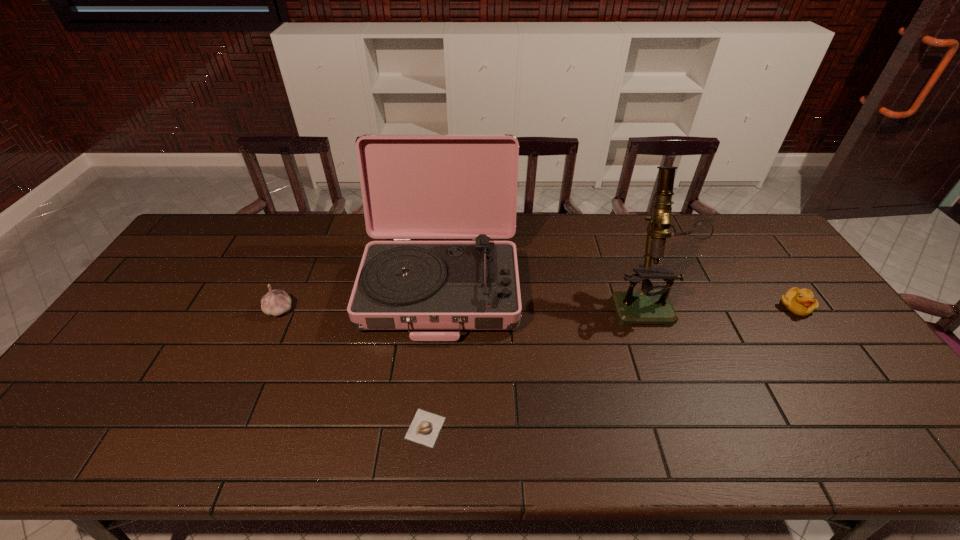
Find the location of a particular element. The height and width of the screenshot is (540, 960). free space located on the left of the taller garlic is located at coordinates (213, 309).

You are a GUI agent. You are given a task and a screenshot of the screen. Output one action in this format:
    pyautogui.click(x=<x>, y=<y>)
    Task: Click on the vacant space situated 0.390m on the front-facing side of the rightmost object
    The height and width of the screenshot is (540, 960).
    Given the screenshot: What is the action you would take?
    pyautogui.click(x=898, y=450)

Where is `free space located on the left of the nearest object`? The height and width of the screenshot is (540, 960). free space located on the left of the nearest object is located at coordinates (271, 428).

You are a GUI agent. You are given a task and a screenshot of the screen. Output one action in this format:
    pyautogui.click(x=<x>, y=<y>)
    Task: Click on the object that is at the far edge
    The width and height of the screenshot is (960, 540).
    Given the screenshot: What is the action you would take?
    pyautogui.click(x=413, y=186)

Locate an element on the screen. object that is at the near edge is located at coordinates (425, 427).

Identify the location of object that is at the right edge. (801, 302).

Where is `vacant space at the far edge of the desktop`? vacant space at the far edge of the desktop is located at coordinates (248, 244).

The image size is (960, 540). In order to click on vacant area at the near edge in this screenshot , I will do `click(671, 432)`.

Find the location of a particular element. free space at the left edge of the desktop is located at coordinates (218, 256).

In the image, there is a desktop. Where is `free space at the right edge`? The image size is (960, 540). free space at the right edge is located at coordinates (840, 340).